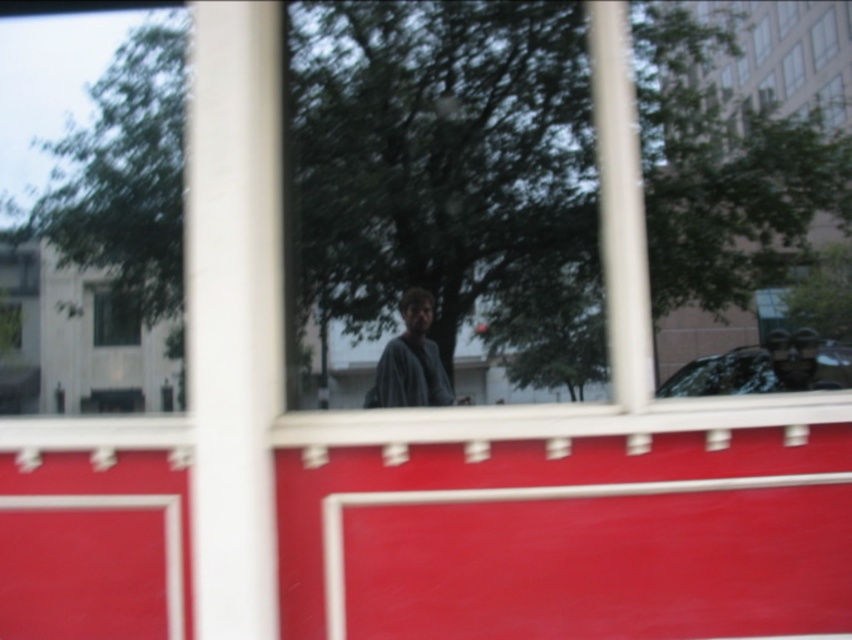
You are driving a car and need to check both side mirrors. The transparent glass window at upper left and the clear glass window at upper right are in your line of sight. Which window allows you to see a wider area of the road behind you?

The transparent glass window at upper left allows you to see a wider area of the road behind you because it is bigger than the clear glass window at upper right.

You are driving a car and want to check the rearview mirror. Which window, the clear glass window at upper right or the transparent glass window at upper right, allows a wider view for the mirror?

The clear glass window at upper right allows a wider view for the mirror because its width is larger than the transparent glass window at upper right.

You are driving a car and need to check both side mirrors. The transparent glass window at upper left and the clear glass window at upper right are in your line of sight. Which window do you need to look through first to check the nearest object?

You should look through the transparent glass window at upper left first because it is closer to you than the clear glass window at upper right, making it the nearest object to check.